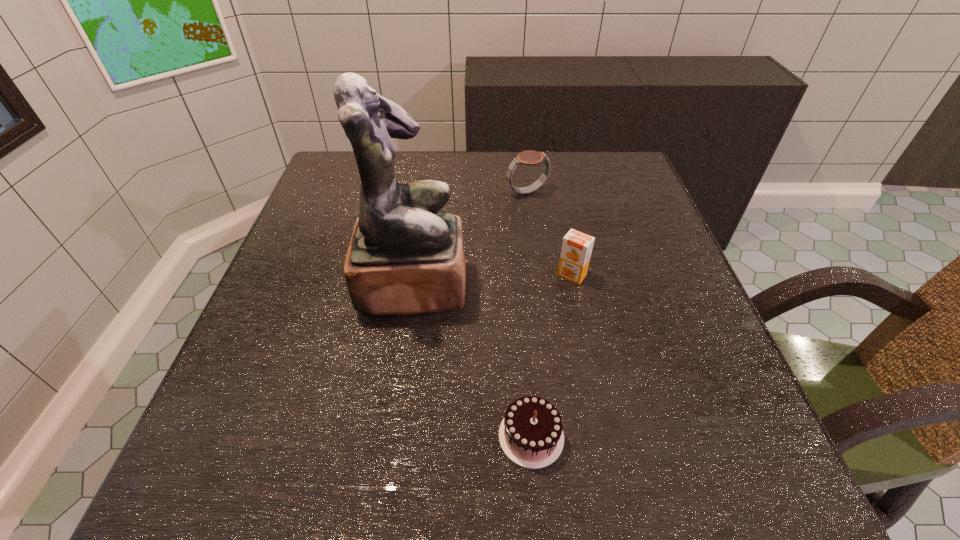
At what (x,y) coordinates should I click in order to perform the action: click on sculpture. Please return your answer as a coordinate pair (x, y). This screenshot has height=540, width=960. Looking at the image, I should click on (405, 257).

Identify the location of the leftmost object. (405, 257).

At what (x,y) coordinates should I click in order to perform the action: click on orange juice. Please return your answer as a coordinate pair (x, y). This screenshot has height=540, width=960. Looking at the image, I should click on (577, 247).

Where is `the farthest object`? the farthest object is located at coordinates (529, 157).

Where is `the shortest object`? This screenshot has height=540, width=960. the shortest object is located at coordinates (531, 435).

Find the location of a particular element. This screenshot has height=540, width=960. the nearest object is located at coordinates (531, 435).

The width and height of the screenshot is (960, 540). Identify the location of vacant area located in a relaxed pose on the tallest object. (541, 284).

Locate an element on the screen. The height and width of the screenshot is (540, 960). free spot located on the front of the orange juice is located at coordinates (596, 392).

The image size is (960, 540). I want to click on vacant area situated 0.130m on the front of the watch, so click(x=533, y=234).

Locate an element on the screen. This screenshot has width=960, height=540. vacant space located on the right of the chocolate cake is located at coordinates (670, 436).